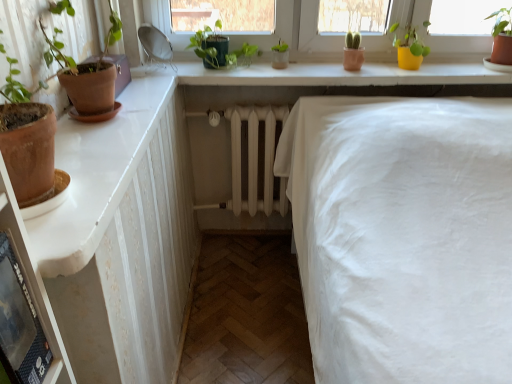
This screenshot has width=512, height=384. I want to click on empty space that is ontop of white glossy dresser at left (from a real-world perspective), so click(x=105, y=138).